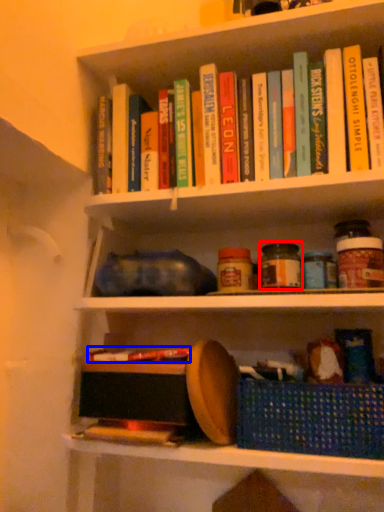
Question: Which of the following is the closest to the observer, glass jar (highlighted by a red box) or book (highlighted by a blue box)?

Choices:
 (A) glass jar
 (B) book

Answer: (B)